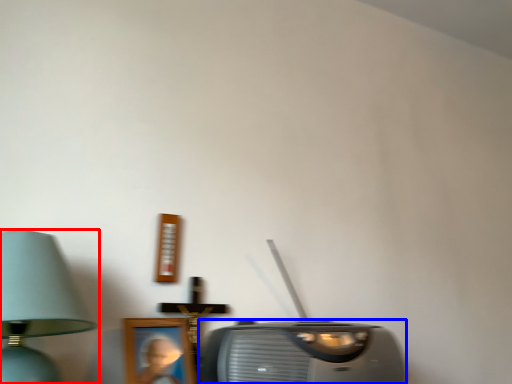
Question: Among these objects, which one is farthest to the camera, lamp (highlighted by a red box) or stereo (highlighted by a blue box)?

Choices:
 (A) lamp
 (B) stereo

Answer: (B)